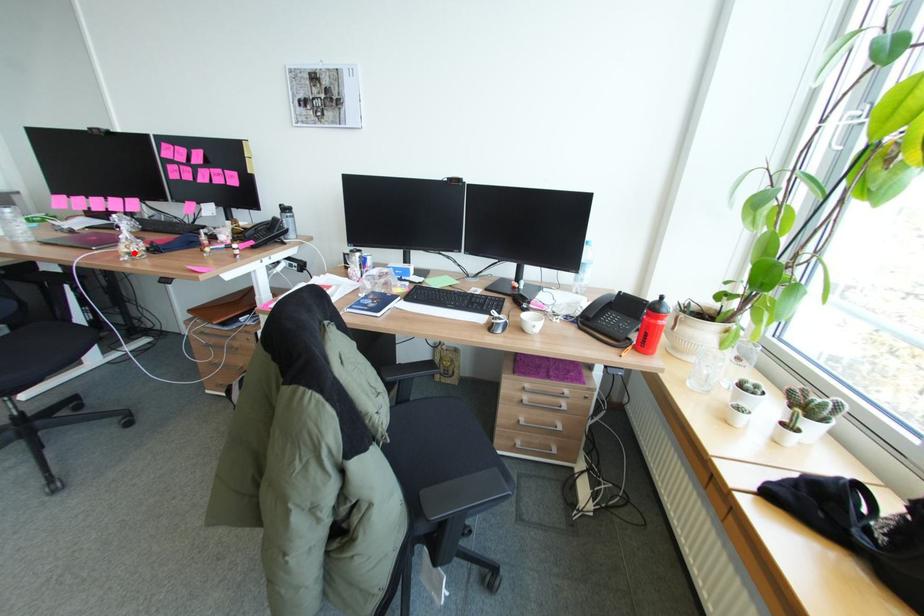
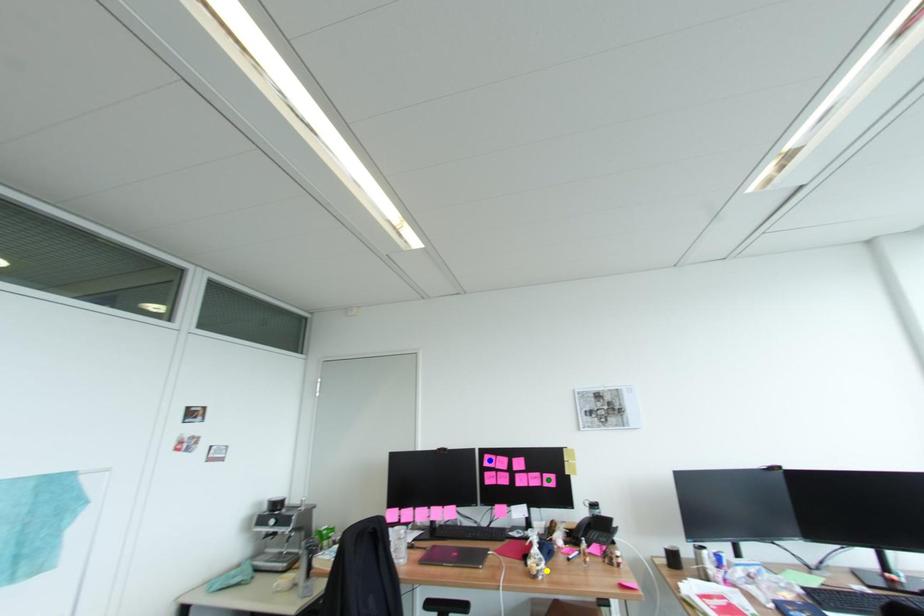
Question: I am providing you with two images of the same scene from different viewpoints. A red point is marked on the first image. You are given multiple points on the second image. Which point in image 2 is actually the same real-world point as the red point in image 1?

Choices:
 (A) green point
 (B) blue point
 (C) yellow point

Answer: (C)